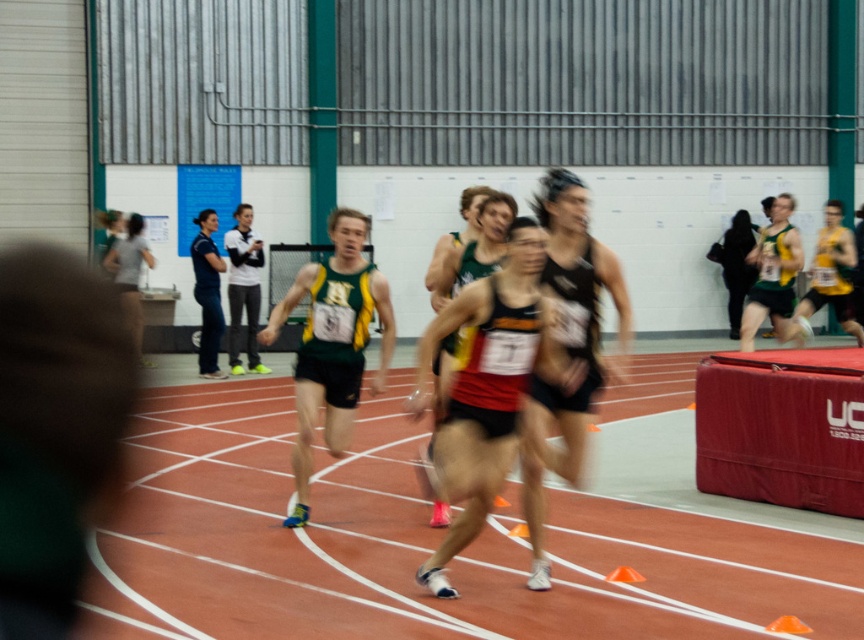
Which is below, reddish-brown athletic uniform at center or black fabric jacket at right?

Positioned lower is reddish-brown athletic uniform at center.

Which of these two, reddish-brown athletic uniform at center or black fabric jacket at right, stands shorter?

Standing shorter between the two is reddish-brown athletic uniform at center.

Between point (518, 241) and point (735, 305), which one is positioned behind?

Positioned behind is point (735, 305).

Locate an element on the screen. The image size is (864, 640). reddish-brown athletic uniform at center is located at coordinates (484, 388).

Which is below, black mesh running shoe at center or green jersey at right?

black mesh running shoe at center

Who is more forward, (543,224) or (770,276)?

Point (543,224) is more forward.

Is point (540, 476) behind point (766, 298)?

No, it is in front of (766, 298).

Identify the location of black mesh running shoe at center. The height and width of the screenshot is (640, 864). (566, 348).

Does black mesh running shoe at center have a lesser width compared to green/yellow athletic uniform at center?

Indeed, black mesh running shoe at center has a lesser width compared to green/yellow athletic uniform at center.

Can you confirm if black mesh running shoe at center is positioned above green/yellow athletic uniform at center?

Yes, black mesh running shoe at center is above green/yellow athletic uniform at center.

What do you see at coordinates (566, 348) in the screenshot? The image size is (864, 640). I see `black mesh running shoe at center` at bounding box center [566, 348].

This screenshot has height=640, width=864. What are the coordinates of `black mesh running shoe at center` in the screenshot? It's located at (566, 348).